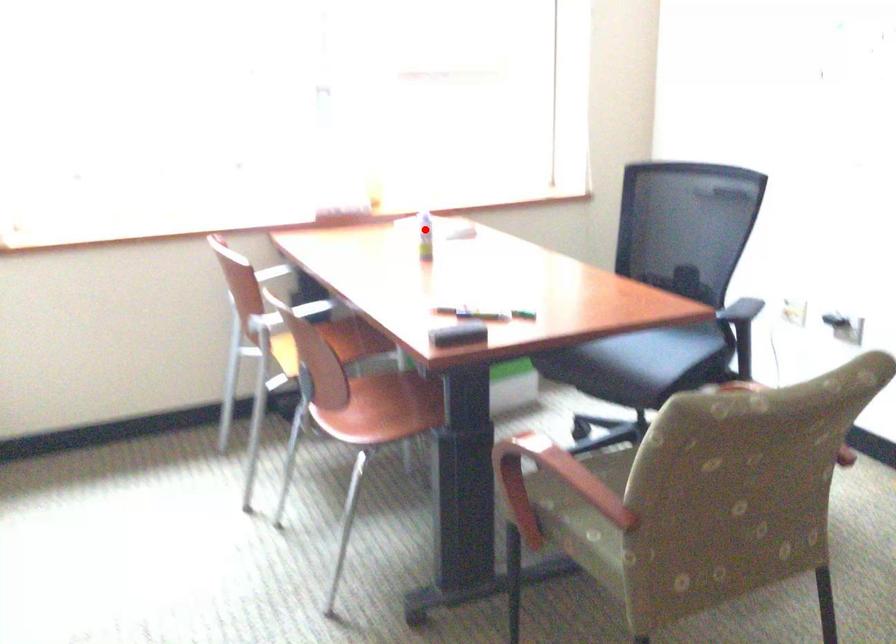
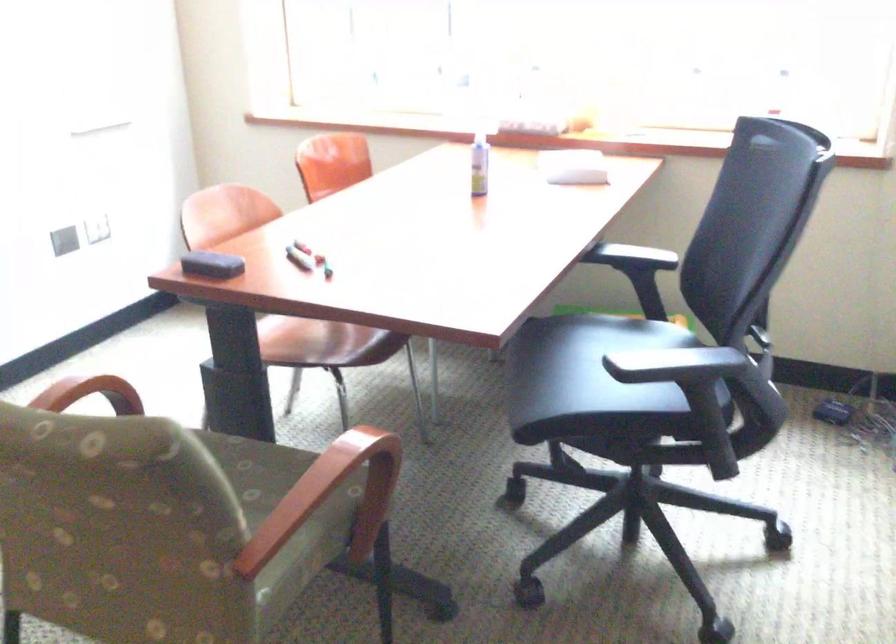
Question: I am providing you with two images of the same scene from different viewpoints. Image1 has a red point marked. In image2, the corresponding 3D location appears at what relative position? Reply with the corresponding letter.

Choices:
 (A) Closer
 (B) Farther

Answer: (A)